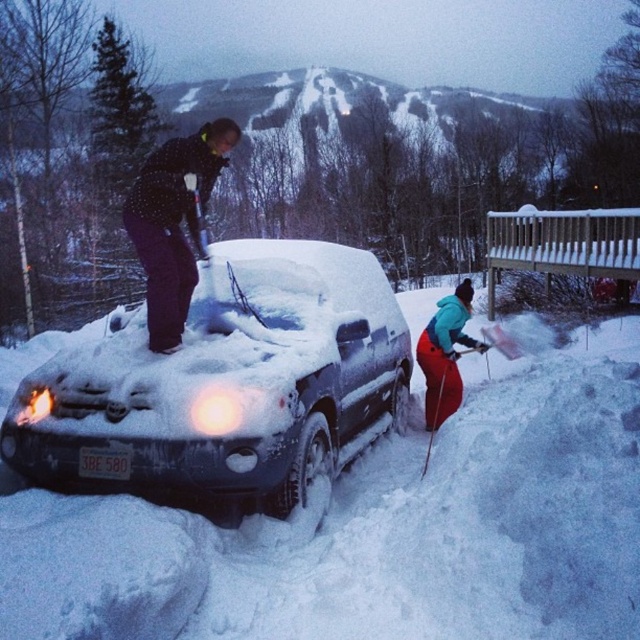
Which is more to the left, white fluffy snow at lower left or polka dot fabric jacket at upper left?

From the viewer's perspective, white fluffy snow at lower left appears more on the left side.

Is point (532, 412) in front of point (148, 310)?

No, it is not.

At what (x,y) coordinates should I click in order to perform the action: click on white fluffy snow at lower left. Please return your answer as a coordinate pair (x, y). Looking at the image, I should click on (378, 531).

In the scene shown: Which of these two, white fluffy snow at lower left or teal fabric jacket at center, stands taller?

teal fabric jacket at center

Is white fluffy snow at lower left below teal fabric jacket at center?

Indeed, white fluffy snow at lower left is positioned under teal fabric jacket at center.

Measure the distance between white fluffy snow at lower left and camera.

white fluffy snow at lower left is 3.99 meters from camera.

Find the location of a particular element. The width and height of the screenshot is (640, 640). white fluffy snow at lower left is located at coordinates (378, 531).

Which is more to the left, polka dot fabric jacket at upper left or teal fabric jacket at center?

Positioned to the left is polka dot fabric jacket at upper left.

Between polka dot fabric jacket at upper left and teal fabric jacket at center, which one is positioned lower?

Positioned lower is teal fabric jacket at center.

Locate an element on the screen. The height and width of the screenshot is (640, 640). polka dot fabric jacket at upper left is located at coordinates pos(173,224).